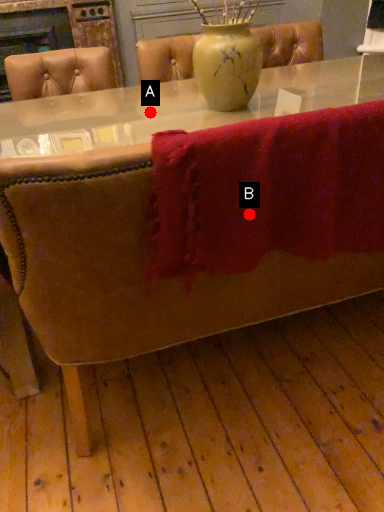
Question: Two points are circled on the image, labeled by A and B beside each circle. Which point is closer to the camera?

Choices:
 (A) A is closer
 (B) B is closer

Answer: (B)